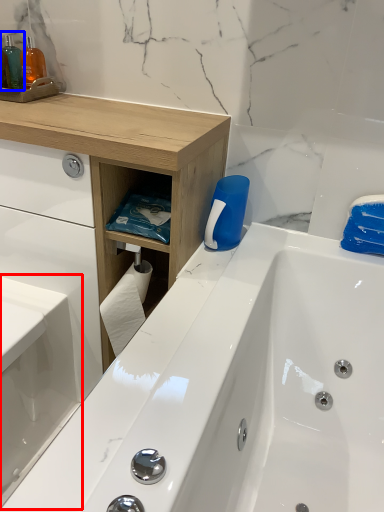
Question: Which point is further to the camera, sink (highlighted by a red box) or toiletry (highlighted by a blue box)?

Choices:
 (A) sink
 (B) toiletry

Answer: (B)